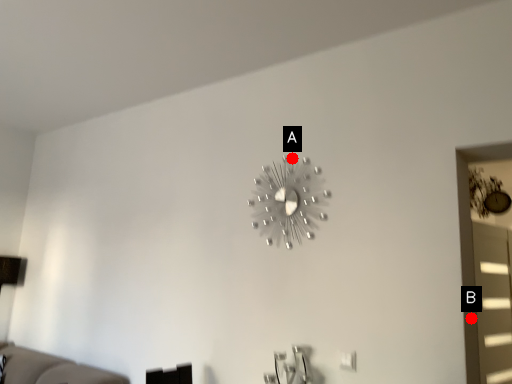
Question: Two points are circled on the image, labeled by A and B beside each circle. Which point appears closest to the camera in this image?

Choices:
 (A) A is closer
 (B) B is closer

Answer: (B)